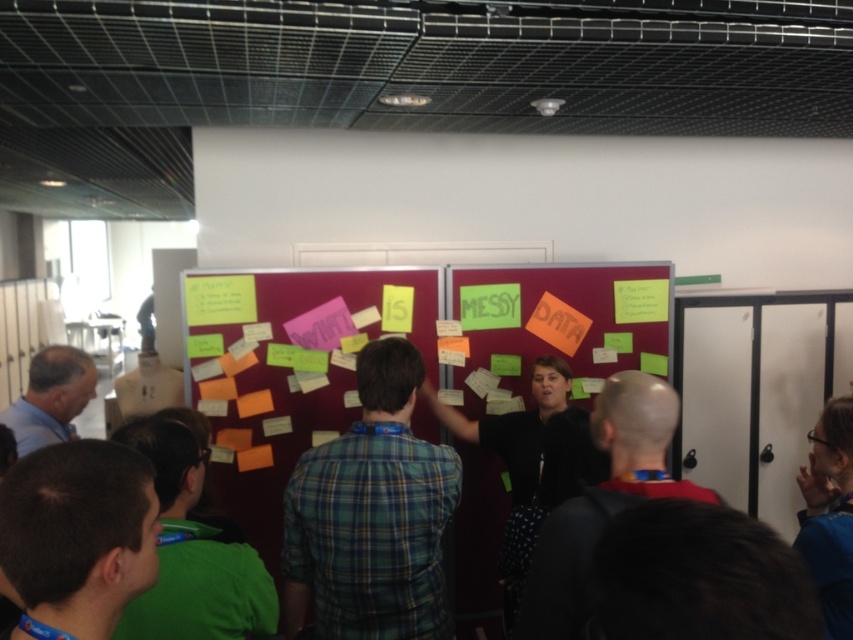
You are standing in front of the large red magnetic board. You notice two points marked on the board at coordinates point (167, 554) and point (844, 621). Which of these points is closer to your viewpoint?

The point at coordinates point (167, 554) is closer to your viewpoint because it is closer to the camera than point (844, 621).

You are a photographer standing in front of the large red magnetic board. You notice two people wearing the green plaid shirt at center and the blue fabric shirt at upper right. Which shirt do you see as larger in size?

The blue fabric shirt at upper right is larger than the green plaid shirt at center.